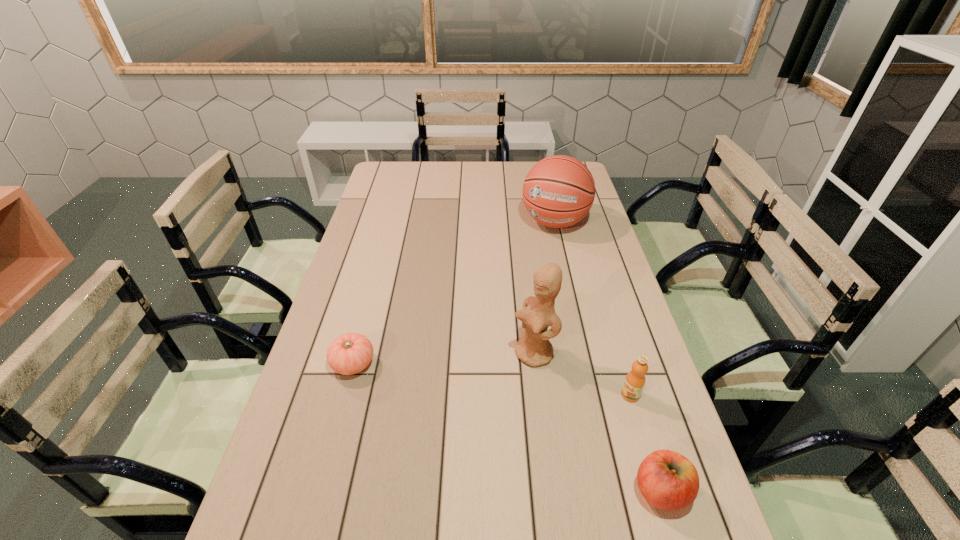
Locate an element on the screen. This screenshot has height=540, width=960. the leftmost object is located at coordinates (350, 353).

Identify the location of the shortest object. The width and height of the screenshot is (960, 540). (x=350, y=353).

Where is `the fourth tallest object`? the fourth tallest object is located at coordinates (667, 480).

At what (x,y) coordinates should I click in order to perform the action: click on apple. Please return your answer as a coordinate pair (x, y). The image size is (960, 540). Looking at the image, I should click on (667, 480).

At what (x,y) coordinates should I click in order to perform the action: click on the fourth farthest object. Please return your answer as a coordinate pair (x, y). Image resolution: width=960 pixels, height=540 pixels. Looking at the image, I should click on (635, 380).

Image resolution: width=960 pixels, height=540 pixels. In order to click on the third tallest object in this screenshot , I will do `click(635, 380)`.

Find the location of a particular element. This screenshot has height=540, width=960. figurine is located at coordinates (534, 348).

The image size is (960, 540). What are the coordinates of `basketball` in the screenshot? It's located at (558, 191).

Locate an element on the screen. Image resolution: width=960 pixels, height=540 pixels. vacant space situated on the front of the leftmost object is located at coordinates (312, 517).

The width and height of the screenshot is (960, 540). In order to click on vacant space located 0.310m on the back of the apple in this screenshot , I will do `click(620, 356)`.